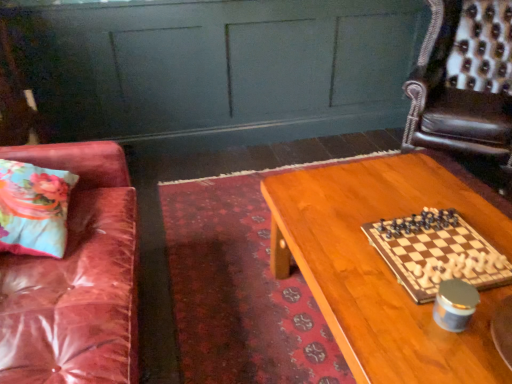
This screenshot has width=512, height=384. Find the location of `unoccupied space behind wooden chessboard at center`. unoccupied space behind wooden chessboard at center is located at coordinates (396, 199).